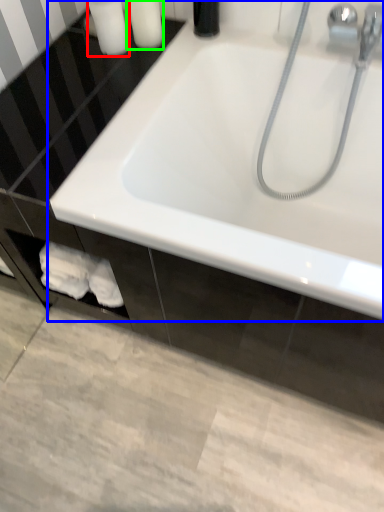
Question: Which is nearer to the toiletry (highlighted by a red box)? bathtub (highlighted by a blue box) or toiletry (highlighted by a green box).

Choices:
 (A) bathtub
 (B) toiletry

Answer: (B)